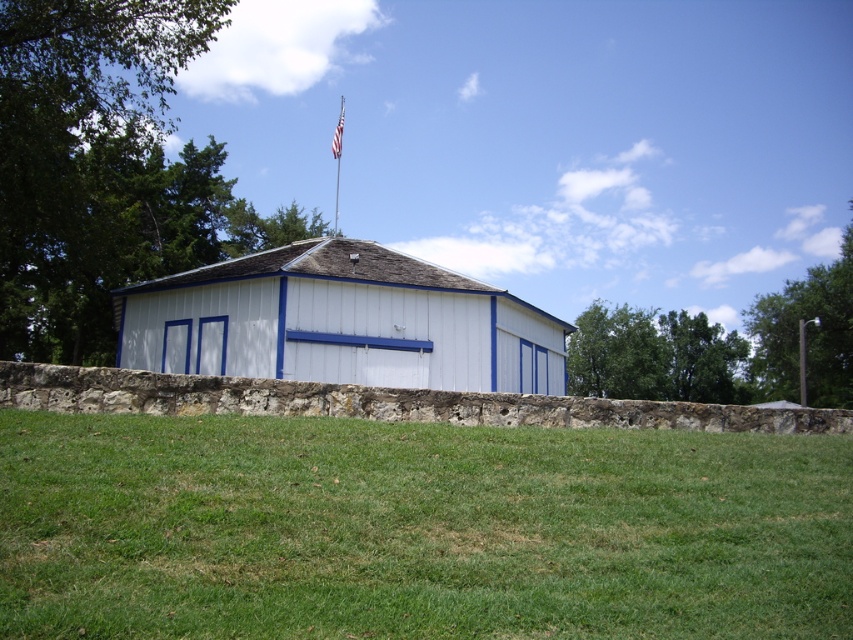
Question: Which point appears farthest from the camera in this image?

Choices:
 (A) (338, 157)
 (B) (343, 108)

Answer: (B)

Question: Is white wood shed at center above metallic flag pole at upper center?

Choices:
 (A) yes
 (B) no

Answer: (B)

Question: Which point is closer to the camera taking this photo?

Choices:
 (A) (335, 150)
 (B) (553, 445)

Answer: (B)

Question: Is green grass at lower center to the right of white wood shed at center from the viewer's perspective?

Choices:
 (A) yes
 (B) no

Answer: (A)

Question: From the image, what is the correct spatial relationship of white wood shed at center in relation to white fabric flag at upper center?

Choices:
 (A) left
 (B) right

Answer: (B)

Question: Among these objects, which one is nearest to the camera?

Choices:
 (A) metallic flag pole at upper center
 (B) green grass at lower center
 (C) white fabric flag at upper center

Answer: (B)